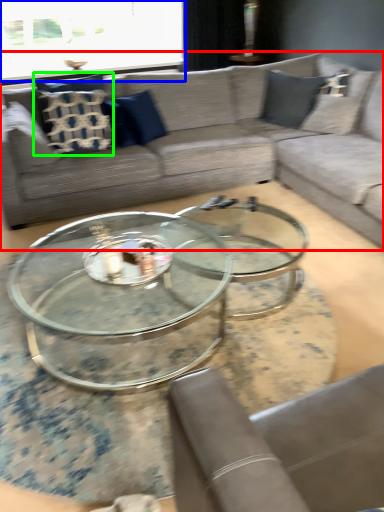
Question: Which is nearer to the studio couch (highlighted by a red box)? window screen (highlighted by a blue box) or pillow (highlighted by a green box).

Choices:
 (A) window screen
 (B) pillow

Answer: (B)